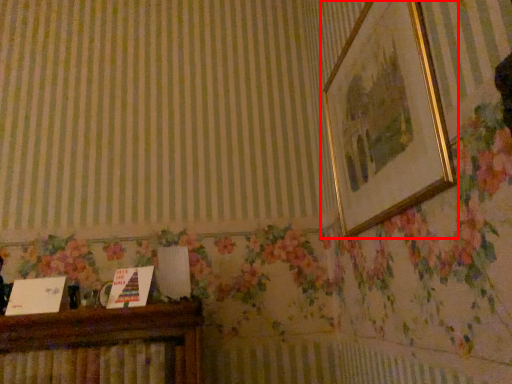
Question: From the image's perspective, what is the correct spatial relationship of picture frame (annotated by the red box) in relation to furniture?

Choices:
 (A) above
 (B) below

Answer: (A)